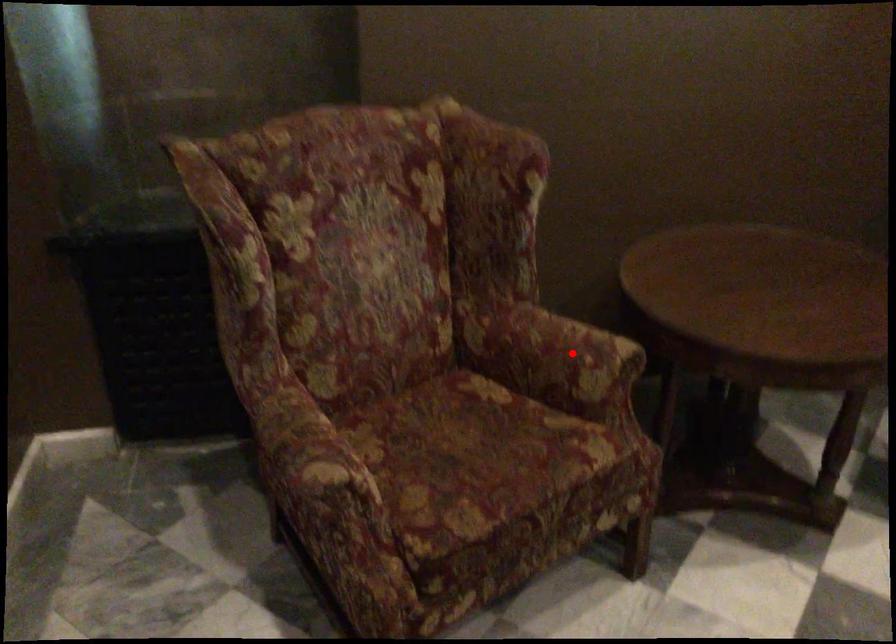
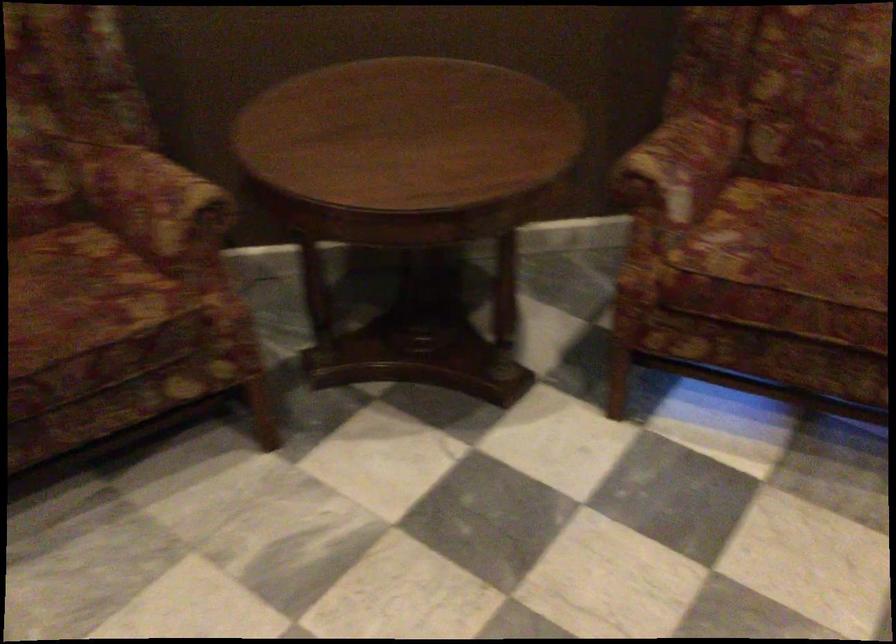
Question: I am providing you with two images of the same scene from different viewpoints. In image1, a red point is highlighted. Considering the same 3D point in image2, which of the following is correct?

Choices:
 (A) It is closer
 (B) It is farther

Answer: (A)